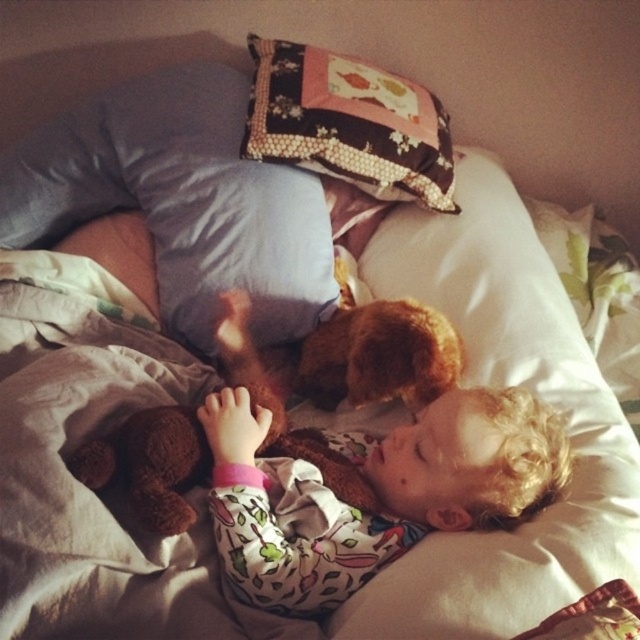
You are a parent trying to make sure your child has enough space to sleep comfortably. You have two pillows on the bed, the fluffy fabric pillow at upper center and the patchwork fabric pillow at upper center. Which pillow should you remove to free up more space on the bed?

The fluffy fabric pillow at upper center is larger in size than the patchwork fabric pillow at upper center, so removing the fluffy fabric pillow at upper center will free up more space.

You are a parent checking on your child. You see the fluffy brown teddy bear at center and the patchwork fabric pillow at upper center. Which object is taller?

The fluffy brown teddy bear at center is shorter than the patchwork fabric pillow at upper center, so the patchwork fabric pillow at upper center is taller.